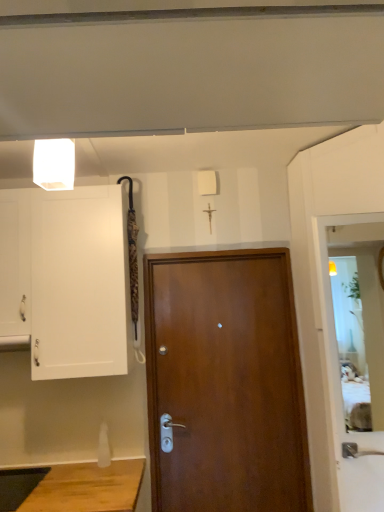
Locate an element on the screen. This screenshot has height=512, width=384. free space above wooden door at center (from a real-world perspective) is located at coordinates (216, 259).